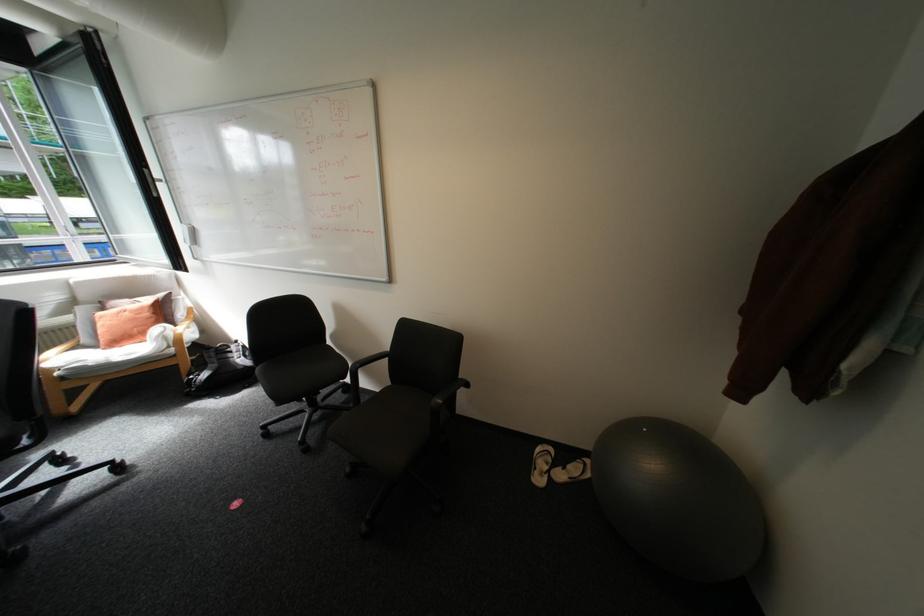
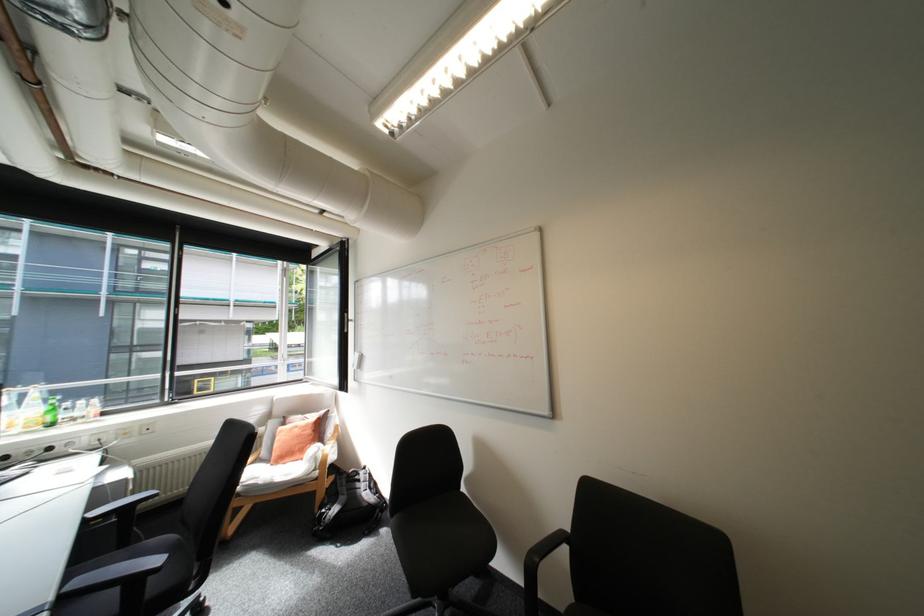
Find the pixel in the second image that matches (x=209, y=375) in the first image.

(339, 509)